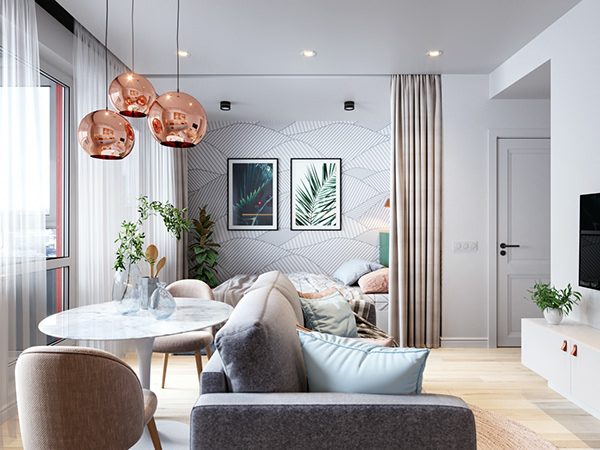
Locate an element on the screen. living room window is located at coordinates pos(60,170), pos(57,298).